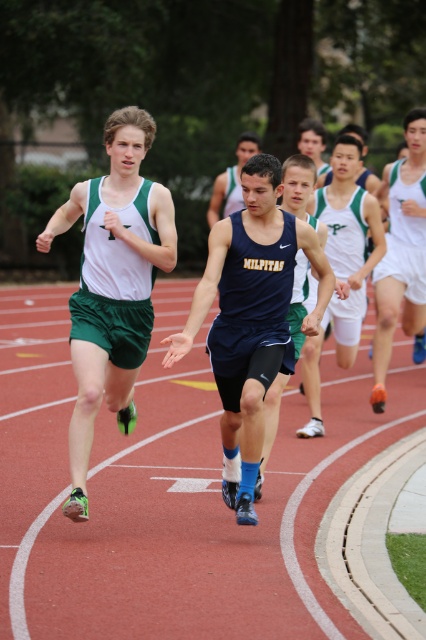
You are a photographer positioned at the starting line of the race. You want to take a photo of the matte green shorts at center without the white matte shorts at right blocking the view. Is this possible?

The white matte shorts at right is further to the viewer than matte green shorts at center, so the white matte shorts at right is blocking the view of the matte green shorts at center. Therefore, it is not possible to take a photo of the matte green shorts at center without the white matte shorts at right blocking the view.

You are a photographer standing at the edge of the running track. You need to capture a photo of the white athletic uniform at center without the red rubber track at center appearing too large in the background. Should you move closer to or farther from the uniform?

Since the red rubber track at center is not as tall as the white athletic uniform at center, you should move closer to the white athletic uniform at center. This will make the uniform larger in the frame and reduce the prominence of the track in the background.